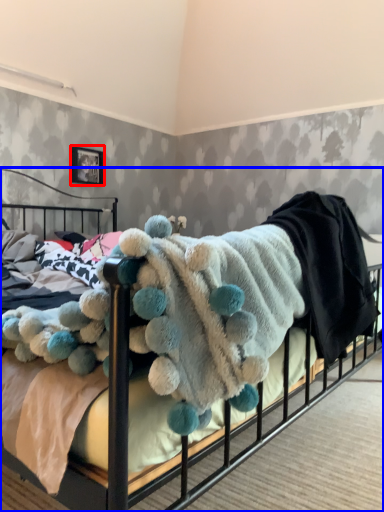
Question: Which point is closer to the camera, picture frame (highlighted by a red box) or bed (highlighted by a blue box)?

Choices:
 (A) picture frame
 (B) bed

Answer: (B)